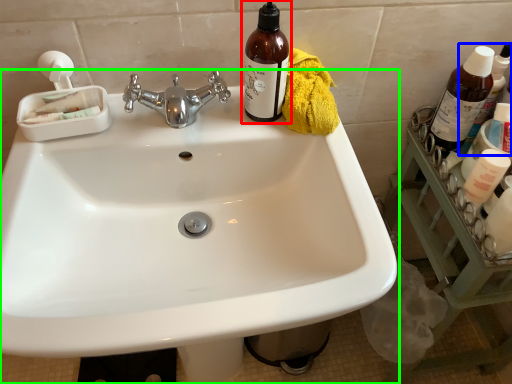
Question: Which object is the closest to the bottle (highlighted by a red box)? Choose among these: bottle (highlighted by a blue box) or sink (highlighted by a green box).

Choices:
 (A) bottle
 (B) sink

Answer: (B)